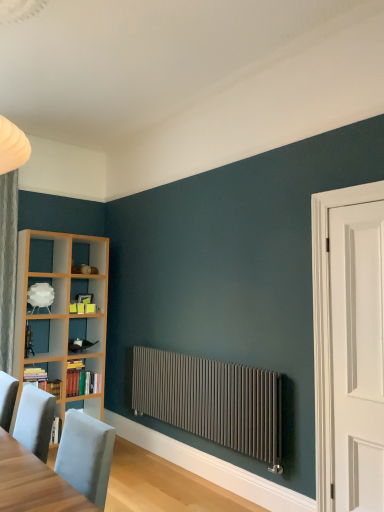
The width and height of the screenshot is (384, 512). Identify the location of vacant space underneath matte gray radiator at center (from a real-world perspective). (202, 481).